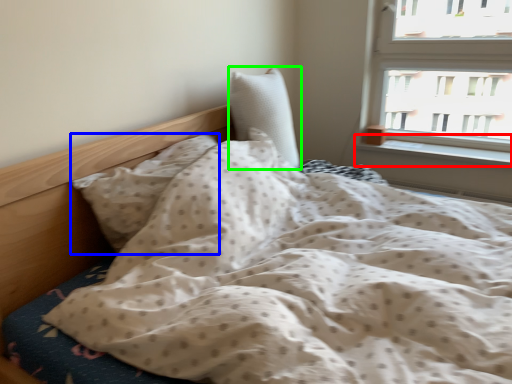
Question: Which object is positioned closest to window sill (highlighted by a red box)? Select from pillow (highlighted by a blue box) and pillow (highlighted by a green box).

Choices:
 (A) pillow
 (B) pillow

Answer: (B)